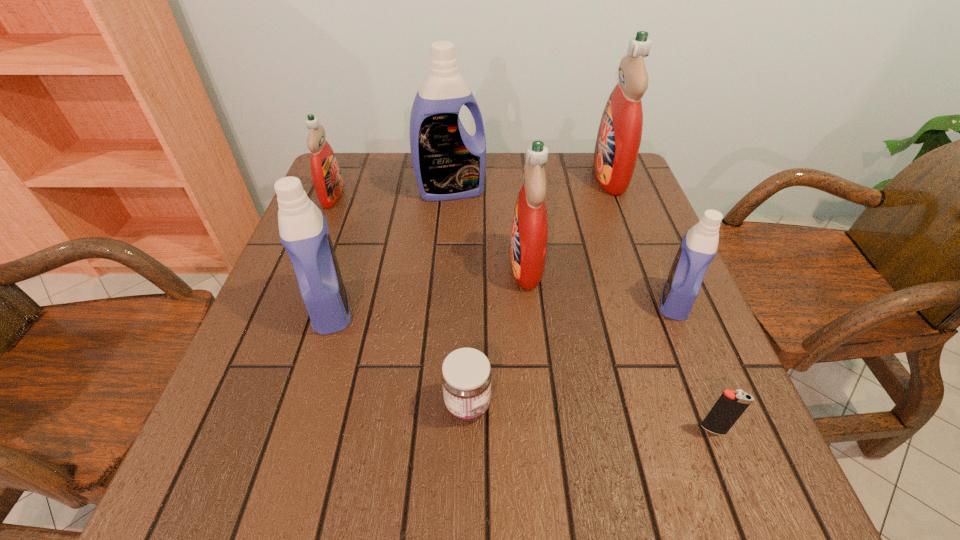
Find the location of a particular element. the closest object to the rightmost blue detergent is located at coordinates (729, 407).

The image size is (960, 540). Find the location of `the sixth closest object to the leftmost red detergent`. the sixth closest object to the leftmost red detergent is located at coordinates (699, 246).

Locate which detergent is the third closest to the biggest blue detergent. Please provide its 2D coordinates. Your answer should be formatted as a tuple, i.e. [(x, y)], where the tuple contains the x and y coordinates of a point satisfying the conditions above.

[(303, 229)]

You are a GUI agent. You are given a task and a screenshot of the screen. Output one action in this format:
    pyautogui.click(x=<x>, y=<y>)
    Task: Click on the detergent that stands as the closest to the biggest red detergent
    The image size is (960, 540).
    Given the screenshot: What is the action you would take?
    pyautogui.click(x=529, y=234)

At what (x,y) coordinates should I click in order to perform the action: click on red detergent that can be found as the second closest to the biggest red detergent. Please return your answer as a coordinate pair (x, y). This screenshot has width=960, height=540. Looking at the image, I should click on (325, 171).

Choose which red detergent is the second nearest neighbor to the jam. Please provide its 2D coordinates. Your answer should be formatted as a tuple, i.e. [(x, y)], where the tuple contains the x and y coordinates of a point satisfying the conditions above.

[(325, 171)]

Find the location of `blue detergent that is the nearest to the jam`. blue detergent that is the nearest to the jam is located at coordinates (303, 229).

Where is `blue detergent that can be found as the second closest to the black igniter`? This screenshot has width=960, height=540. blue detergent that can be found as the second closest to the black igniter is located at coordinates (303, 229).

Locate an element on the screen. This screenshot has height=540, width=960. vacant region that satisfies the following two spatial constraints: 1. on the front surface of the smallest blue detergent; 2. on the left side of the biggest red detergent is located at coordinates (657, 301).

The height and width of the screenshot is (540, 960). In order to click on free location that satisfies the following two spatial constraints: 1. on the front surface of the black igniter; 2. on the left side of the fourth object from right to left in this screenshot , I will do `click(543, 429)`.